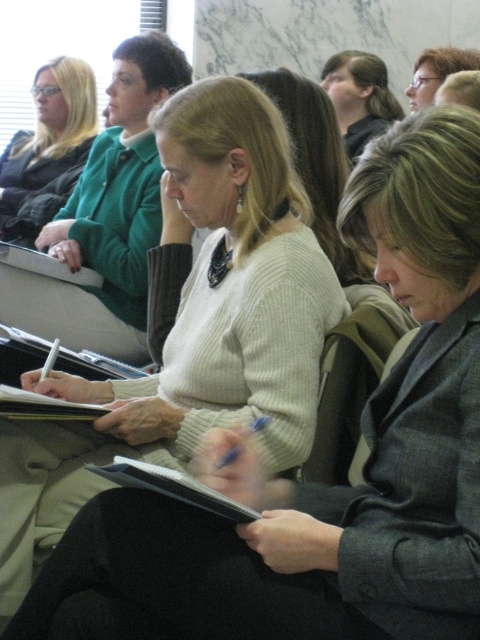
Can you confirm if matte green sweater at upper left is thinner than black matte notebook at center?

In fact, matte green sweater at upper left might be wider than black matte notebook at center.

Is point (24, 182) less distant than point (195, 483)?

No, (24, 182) is further to viewer.

Where is `matte green sweater at upper left`? Image resolution: width=480 pixels, height=640 pixels. matte green sweater at upper left is located at coordinates (48, 148).

Can you confirm if matte black hair at upper center is taller than matte black glasses at upper center?

Correct, matte black hair at upper center is much taller as matte black glasses at upper center.

This screenshot has height=640, width=480. Find the location of `matte black hair at upper center`. matte black hair at upper center is located at coordinates (360, 97).

Does light beige sweater at center have a larger size compared to white paper notebook at center?

Correct, light beige sweater at center is larger in size than white paper notebook at center.

Does point (342, 173) come behind point (38, 406)?

Yes, point (342, 173) is behind point (38, 406).

Which is in front, point (295, 147) or point (61, 413)?

Positioned in front is point (61, 413).

The image size is (480, 640). Find the location of `light beige sweater at center`. light beige sweater at center is located at coordinates (315, 161).